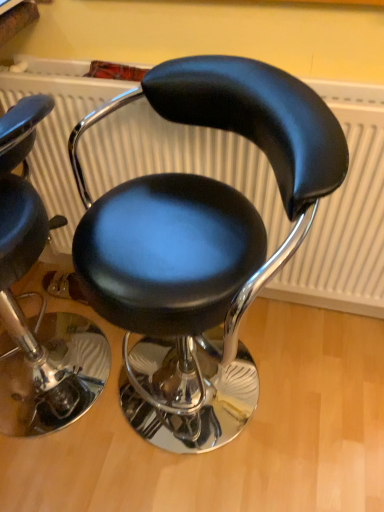
Question: Can you confirm if black leather stool at center, which is counted as the first chair, starting from the right, is smaller than black leather stool at center, positioned as the second chair in right-to-left order?

Choices:
 (A) no
 (B) yes

Answer: (A)

Question: From the image's perspective, would you say black leather stool at center, which is counted as the first chair, starting from the right, is positioned over black leather stool at center, positioned as the second chair in right-to-left order?

Choices:
 (A) yes
 (B) no

Answer: (B)

Question: From a real-world perspective, is black leather stool at center, marked as the second chair in a left-to-right arrangement, on black leather stool at center, acting as the 1th chair starting from the left?

Choices:
 (A) yes
 (B) no

Answer: (A)

Question: Is black leather stool at center, which is counted as the first chair, starting from the right, looking in the opposite direction of black leather stool at center, positioned as the second chair in right-to-left order?

Choices:
 (A) no
 (B) yes

Answer: (A)

Question: Is black leather stool at center, positioned as the second chair in right-to-left order, a part of black leather stool at center, marked as the second chair in a left-to-right arrangement?

Choices:
 (A) no
 (B) yes

Answer: (A)

Question: From the image's perspective, is black leather stool at center, marked as the second chair in a left-to-right arrangement, located beneath black leather stool at center, positioned as the second chair in right-to-left order?

Choices:
 (A) yes
 (B) no

Answer: (A)

Question: Are black leather stool at center, acting as the 1th chair starting from the left, and black leather stool at center, which is counted as the first chair, starting from the right, making contact?

Choices:
 (A) yes
 (B) no

Answer: (B)

Question: Is black leather stool at center, acting as the 1th chair starting from the left, oriented towards black leather stool at center, which is counted as the first chair, starting from the right?

Choices:
 (A) no
 (B) yes

Answer: (A)

Question: Is black leather stool at center, acting as the 1th chair starting from the left, looking in the opposite direction of black leather stool at center, marked as the second chair in a left-to-right arrangement?

Choices:
 (A) no
 (B) yes

Answer: (B)

Question: From the image's perspective, is black leather stool at center, positioned as the second chair in right-to-left order, located above black leather stool at center, marked as the second chair in a left-to-right arrangement?

Choices:
 (A) no
 (B) yes

Answer: (B)

Question: From a real-world perspective, is black leather stool at center, acting as the 1th chair starting from the left, on top of black leather stool at center, which is counted as the first chair, starting from the right?

Choices:
 (A) yes
 (B) no

Answer: (B)

Question: Is black leather stool at center, which is counted as the first chair, starting from the right, completely or partially inside black leather stool at center, acting as the 1th chair starting from the left?

Choices:
 (A) yes
 (B) no

Answer: (B)

Question: From the image's perspective, is black leather stool at center, which is counted as the first chair, starting from the right, located above or below black leather stool at center, positioned as the second chair in right-to-left order?

Choices:
 (A) below
 (B) above

Answer: (A)